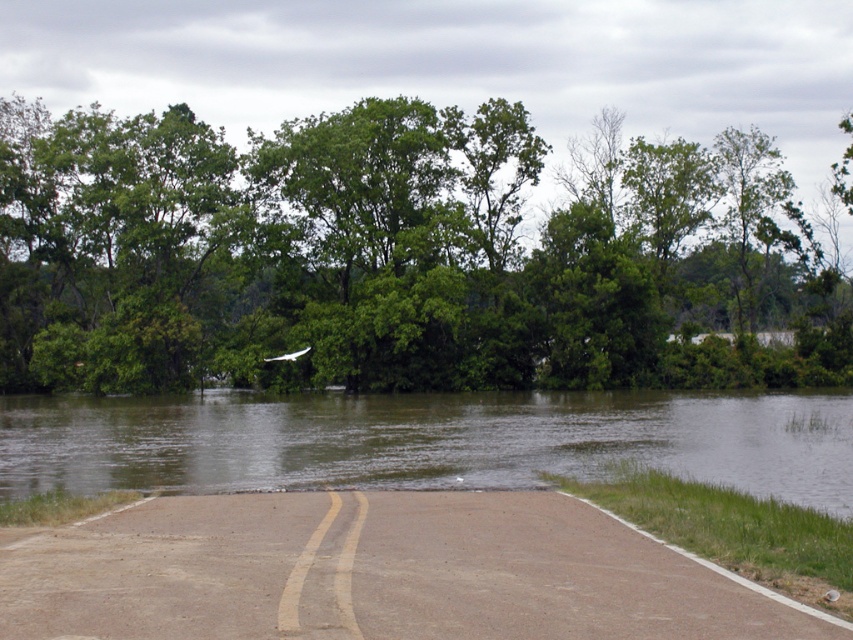
Question: Which of the following is the farthest from the observer?

Choices:
 (A) (793, 312)
 (B) (199, 448)

Answer: (A)

Question: Can you confirm if green leafy tree at upper center is thinner than brown muddy water at center?

Choices:
 (A) no
 (B) yes

Answer: (A)

Question: Does green leafy tree at upper center appear on the right side of brown muddy water at center?

Choices:
 (A) no
 (B) yes

Answer: (A)

Question: Which of the following is the farthest from the observer?

Choices:
 (A) green leafy tree at upper center
 (B) brown muddy water at center

Answer: (A)

Question: Which object is farther from the camera taking this photo?

Choices:
 (A) brown muddy water at center
 (B) green leafy tree at upper center

Answer: (B)

Question: Does green leafy tree at upper center lie in front of brown muddy water at center?

Choices:
 (A) yes
 (B) no

Answer: (B)